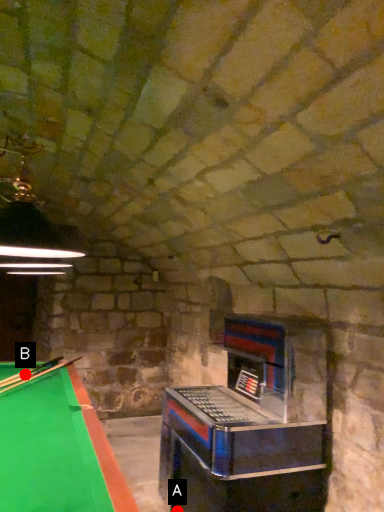
Question: Two points are circled on the image, labeled by A and B beside each circle. Which point appears farthest from the camera in this image?

Choices:
 (A) A is further
 (B) B is further

Answer: (B)